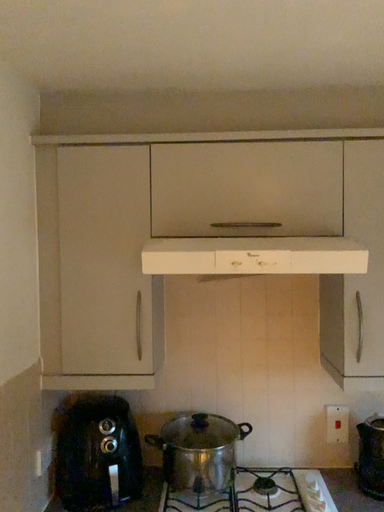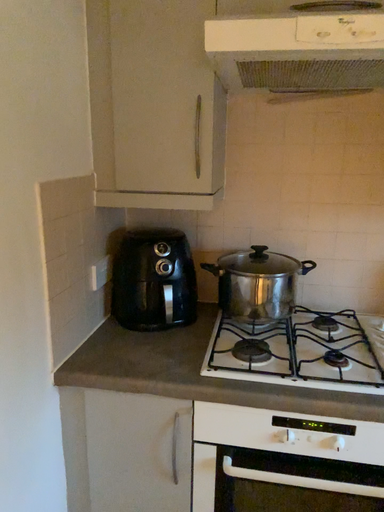
Question: How did the camera likely rotate when shooting the video?

Choices:
 (A) rotated right
 (B) rotated left

Answer: (B)